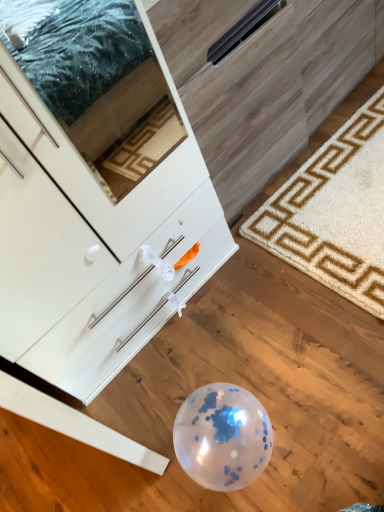
Question: From a real-world perspective, is white textured rug at lower right located beneath white glossy cabinet at lower left?

Choices:
 (A) no
 (B) yes

Answer: (A)

Question: Would you consider white textured rug at lower right to be distant from white glossy cabinet at lower left?

Choices:
 (A) yes
 (B) no

Answer: (B)

Question: Is white glossy cabinet at lower left at the back of white textured rug at lower right?

Choices:
 (A) no
 (B) yes

Answer: (B)

Question: Considering the relative sizes of white textured rug at lower right and white glossy cabinet at lower left in the image provided, is white textured rug at lower right thinner than white glossy cabinet at lower left?

Choices:
 (A) no
 (B) yes

Answer: (B)

Question: Is white textured rug at lower right smaller than white glossy cabinet at lower left?

Choices:
 (A) yes
 (B) no

Answer: (A)

Question: Considering the relative sizes of white textured rug at lower right and white glossy cabinet at lower left in the image provided, is white textured rug at lower right wider than white glossy cabinet at lower left?

Choices:
 (A) yes
 (B) no

Answer: (B)

Question: From the image's perspective, is white glossy cabinet at lower left on white textured rug at lower right?

Choices:
 (A) yes
 (B) no

Answer: (B)

Question: Can we say white glossy cabinet at lower left lies outside white textured rug at lower right?

Choices:
 (A) no
 (B) yes

Answer: (B)

Question: Is white glossy cabinet at lower left at the left side of white textured rug at lower right?

Choices:
 (A) no
 (B) yes

Answer: (B)

Question: Is white glossy cabinet at lower left facing away from white textured rug at lower right?

Choices:
 (A) yes
 (B) no

Answer: (A)

Question: Does white glossy cabinet at lower left have a greater height compared to white textured rug at lower right?

Choices:
 (A) no
 (B) yes

Answer: (B)

Question: Can you confirm if white glossy cabinet at lower left is bigger than white textured rug at lower right?

Choices:
 (A) yes
 (B) no

Answer: (A)

Question: In terms of size, does white textured rug at lower right appear bigger or smaller than white glossy cabinet at lower left?

Choices:
 (A) small
 (B) big

Answer: (A)